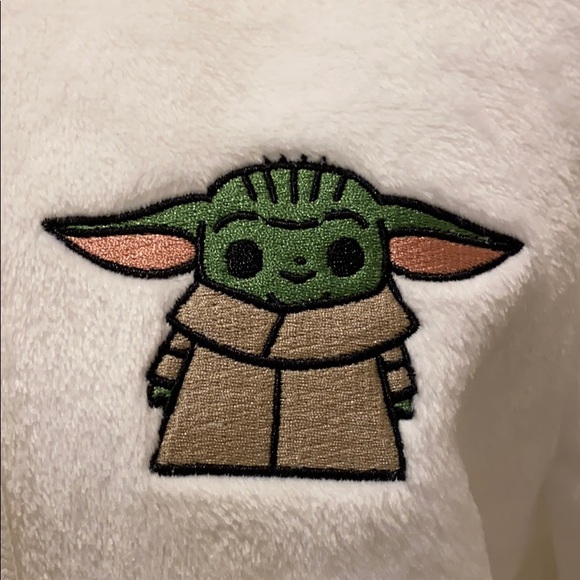
You are a GUI agent. You are given a task and a screenshot of the screen. Output one action in this format:
    pyautogui.click(x=<x>, y=<y>)
    Task: Click on the blanket
    
    Given the screenshot: What is the action you would take?
    coord(511,274)